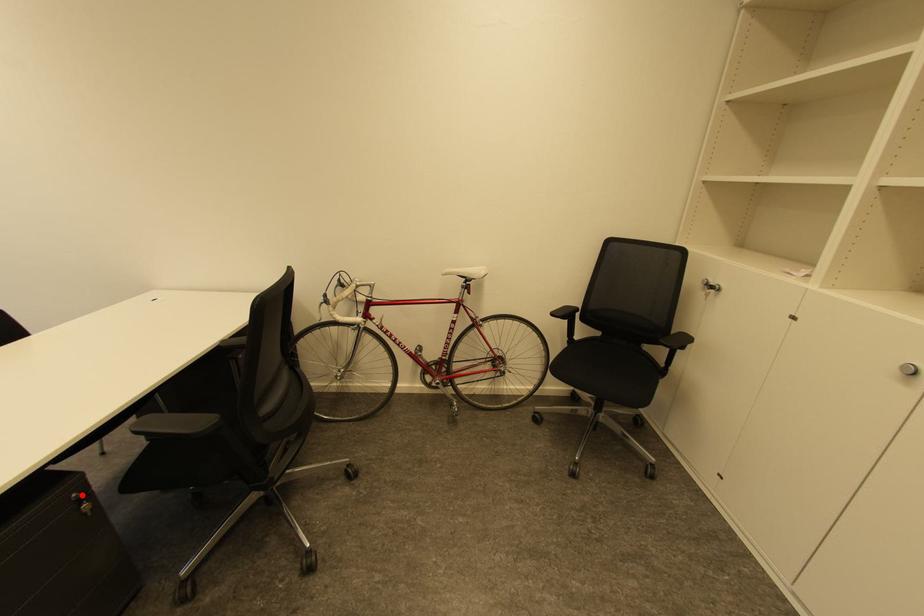
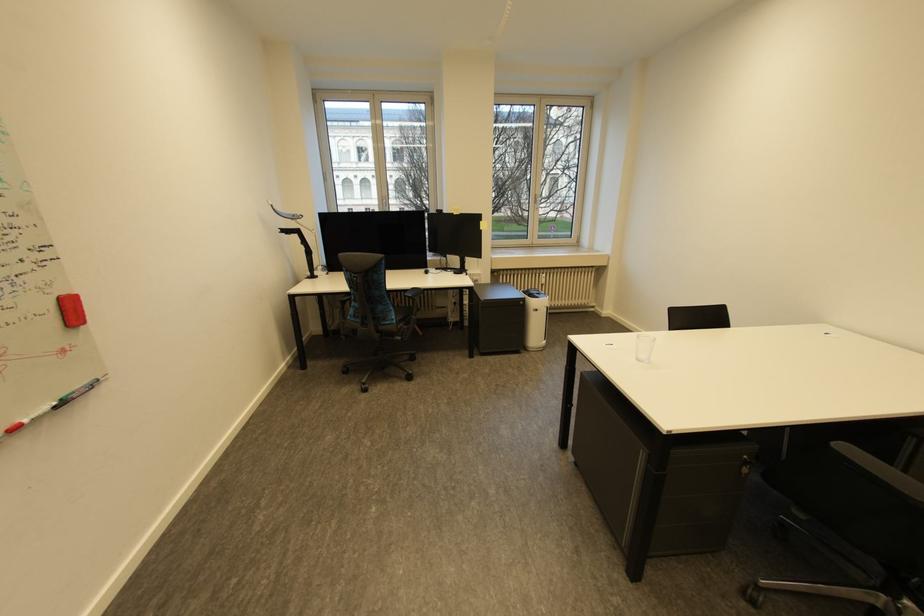
Question: I am providing you with two images of the same scene from different viewpoints. Given a red point in image1, look at the same physical point in image2. Is it:

Choices:
 (A) Closer to the viewpoint
 (B) Farther from the viewpoint

Answer: (A)